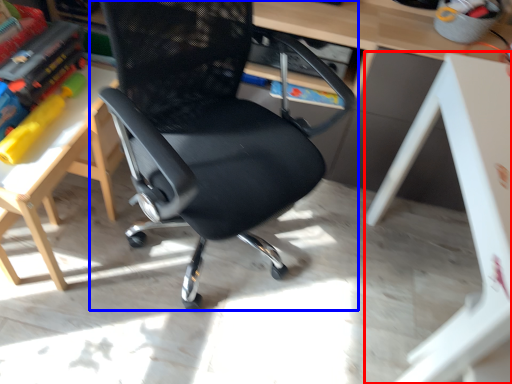
Question: Which point is further to the camera, table (highlighted by a red box) or chair (highlighted by a blue box)?

Choices:
 (A) table
 (B) chair

Answer: (A)